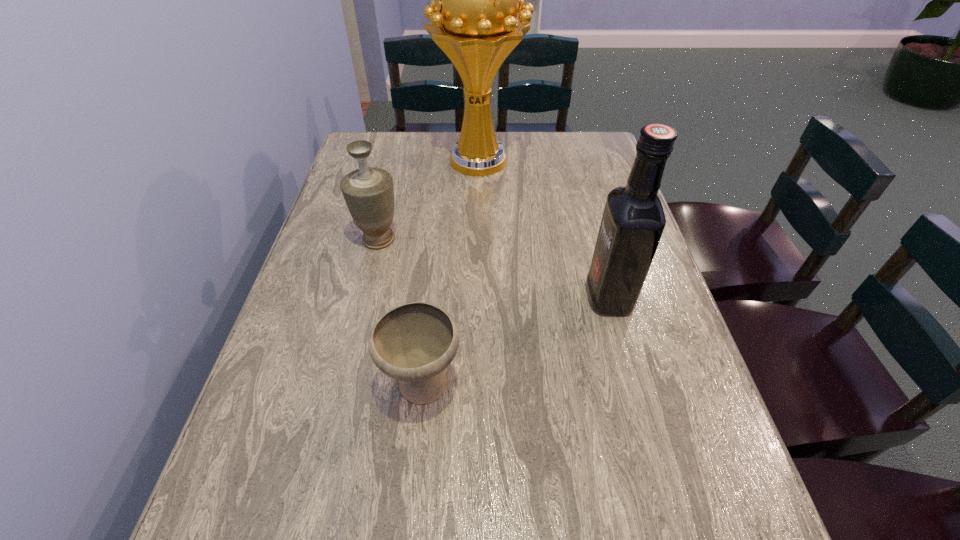
The image size is (960, 540). Identify the location of free space at the far left corner of the desktop. (376, 139).

The height and width of the screenshot is (540, 960). Identify the location of blank region between the trophy_cup and the second farthest object. (429, 200).

Locate an element on the screen. The width and height of the screenshot is (960, 540). vacant space that's between the third tallest object and the second tallest object is located at coordinates (493, 268).

You are a GUI agent. You are given a task and a screenshot of the screen. Output one action in this format:
    pyautogui.click(x=<x>, y=<y>)
    Task: Click on the blank region between the third nearest object and the third shortest object
    The height and width of the screenshot is (540, 960).
    Given the screenshot: What is the action you would take?
    pyautogui.click(x=493, y=268)

The image size is (960, 540). Find the location of `free point between the second tallest object and the trophy_cup`. free point between the second tallest object and the trophy_cup is located at coordinates 544,229.

You are a GUI agent. You are given a task and a screenshot of the screen. Output one action in this format:
    pyautogui.click(x=<x>, y=<y>)
    Task: Click on the free spot between the trophy_cup and the nearest object
    This screenshot has width=960, height=540.
    Given the screenshot: What is the action you would take?
    pyautogui.click(x=450, y=273)

The image size is (960, 540). I want to click on free point between the shortest object and the liquor, so click(516, 341).

At what (x,y) coordinates should I click in order to perform the action: click on vacant area between the rightmost object and the farthest object. Please return your answer as a coordinate pair (x, y). Image resolution: width=960 pixels, height=540 pixels. Looking at the image, I should click on (544, 229).

At what (x,y) coordinates should I click in order to perform the action: click on unoccupied position between the nearest object and the liquor. Please return your answer as a coordinate pair (x, y). The width and height of the screenshot is (960, 540). Looking at the image, I should click on (516, 341).

The image size is (960, 540). I want to click on free point between the urn and the farthest object, so [x=429, y=200].